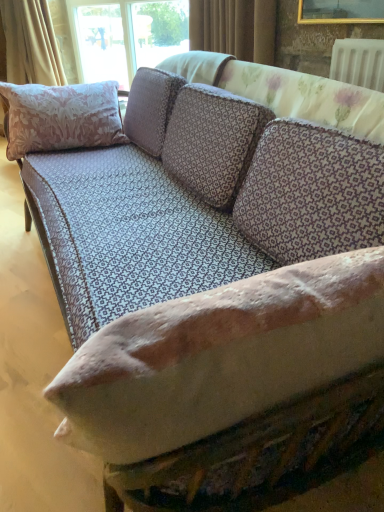
Question: Should I look upward or downward to see brown textured curtain at upper center, which is counted as the 2th curtain, starting from the left?

Choices:
 (A) down
 (B) up

Answer: (B)

Question: From the image's perspective, is brown textured curtain at upper center, which is counted as the 2th curtain, starting from the left, on pink floral fabric pillow at left?

Choices:
 (A) yes
 (B) no

Answer: (A)

Question: Is brown textured curtain at upper center, which is the first curtain from front to back, to the left of pink floral fabric pillow at left from the viewer's perspective?

Choices:
 (A) yes
 (B) no

Answer: (B)

Question: Can pink floral fabric pillow at left be found inside brown textured curtain at upper center, which is counted as the 2th curtain, starting from the left?

Choices:
 (A) no
 (B) yes

Answer: (A)

Question: Is brown textured curtain at upper center, which is counted as the 2th curtain, starting from the left, positioned in front of pink floral fabric pillow at left?

Choices:
 (A) no
 (B) yes

Answer: (A)

Question: Does brown textured curtain at upper center, the second curtain in the back-to-front sequence, have a greater width compared to pink floral fabric pillow at left?

Choices:
 (A) yes
 (B) no

Answer: (B)

Question: From the image's perspective, would you say pink floral fabric pillow at left is shown under brown textured curtain at upper center, the second curtain in the back-to-front sequence?

Choices:
 (A) yes
 (B) no

Answer: (A)

Question: Are pink floral fabric pillow at left and brown textured curtain at upper center, which is the first curtain from front to back, located far from each other?

Choices:
 (A) yes
 (B) no

Answer: (B)

Question: Is pink floral fabric pillow at left taller than brown textured curtain at upper center, which is the first curtain from front to back?

Choices:
 (A) yes
 (B) no

Answer: (A)

Question: Is pink floral fabric pillow at left directly adjacent to brown textured curtain at upper center, which is counted as the 2th curtain, starting from the left?

Choices:
 (A) yes
 (B) no

Answer: (B)

Question: Does pink floral fabric pillow at left have a lesser height compared to brown textured curtain at upper center, which is counted as the 2th curtain, starting from the left?

Choices:
 (A) no
 (B) yes

Answer: (A)

Question: Is pink floral fabric pillow at left at the right side of brown textured curtain at upper center, which is counted as the 1th curtain, starting from the right?

Choices:
 (A) no
 (B) yes

Answer: (A)

Question: Is pink floral fabric pillow at left to the right of beige fabric curtain at upper left, the first curtain in the back-to-front sequence, from the viewer's perspective?

Choices:
 (A) no
 (B) yes

Answer: (B)